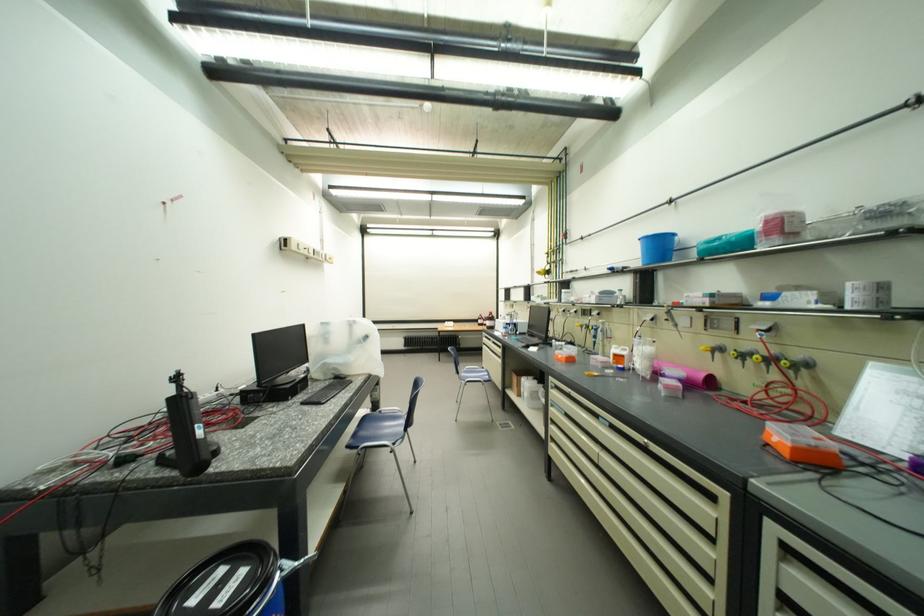
Image resolution: width=924 pixels, height=616 pixels. Describe the element at coordinates (657, 246) in the screenshot. I see `the blue plastic bucket` at that location.